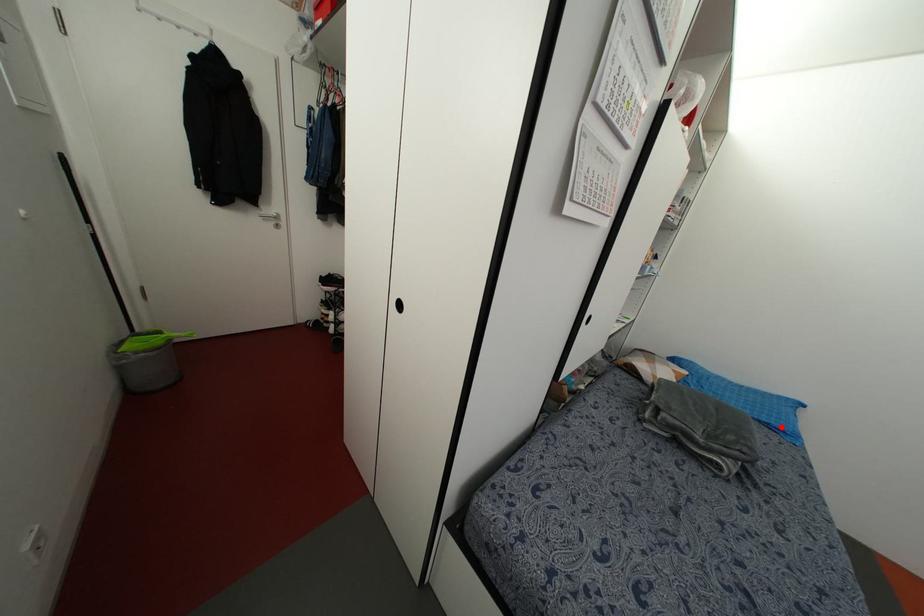
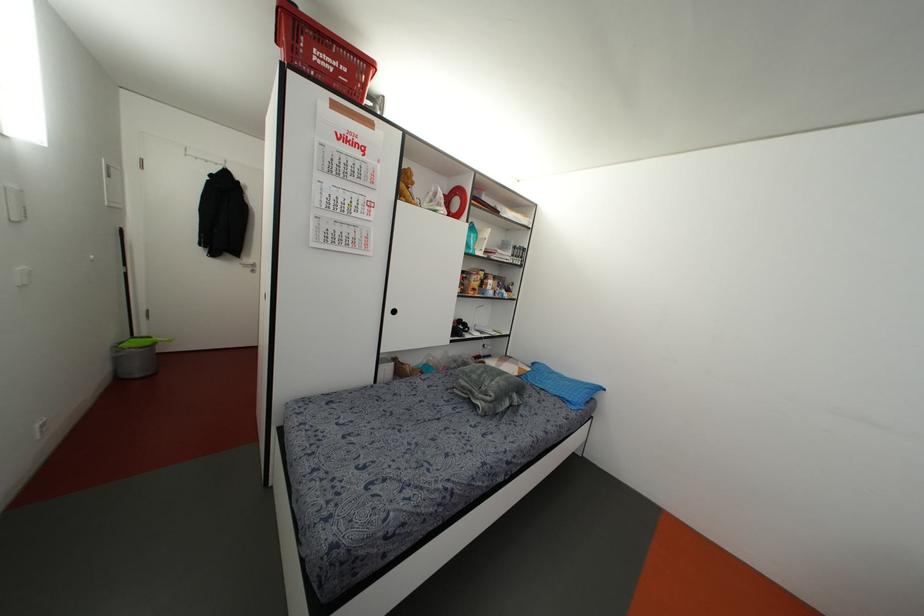
The point at the highlighted location is marked in the first image. Where is the corresponding point in the second image?

(569, 399)